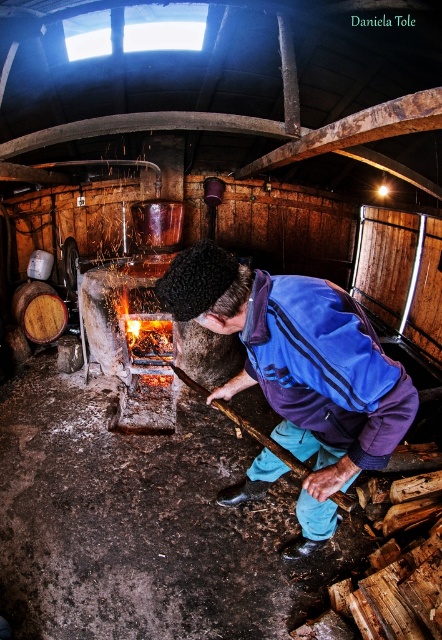
Between point (289, 380) and point (39, 332), which one is positioned behind?

The point (39, 332) is more distant.

Locate an element on the screen. The height and width of the screenshot is (640, 442). blue fleece jacket at center is located at coordinates tap(301, 371).